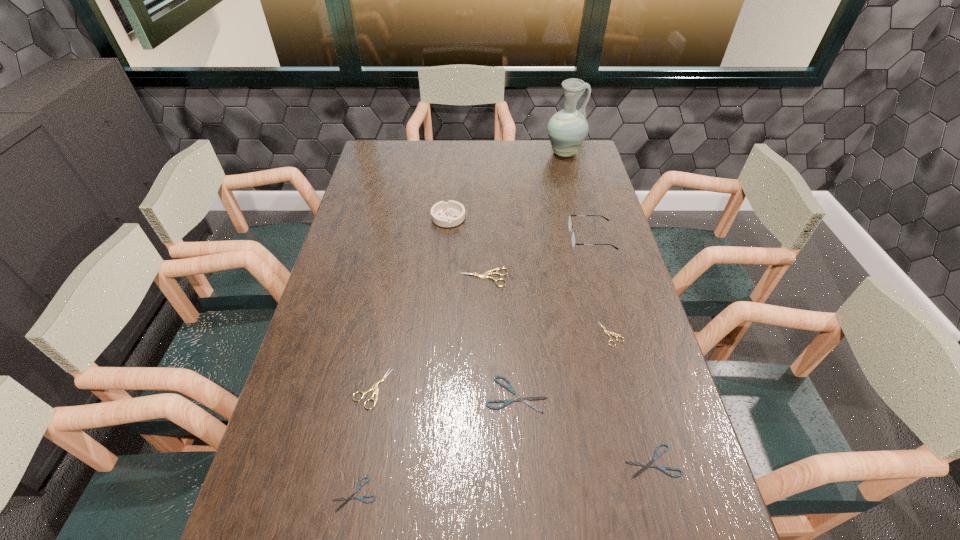
Image resolution: width=960 pixels, height=540 pixels. Identify the location of free space located 0.210m on the front of the second beige shears from left to right. (484, 345).

This screenshot has height=540, width=960. Identify the location of vacant space situated on the front of the fifth shortest shears. (362, 443).

Locate an element on the screen. free space located 0.130m on the back of the second black shears from right to left is located at coordinates (513, 334).

The width and height of the screenshot is (960, 540). Find the location of `free space located 0.100m on the back of the rightmost beige shears`. free space located 0.100m on the back of the rightmost beige shears is located at coordinates (601, 294).

This screenshot has width=960, height=540. I want to click on vacant space located 0.060m on the left of the rightmost black shears, so click(x=597, y=461).

Where is `free location located on the back of the shortest shears`? The width and height of the screenshot is (960, 540). free location located on the back of the shortest shears is located at coordinates 381,354.

Where is `object present at the far edge`? This screenshot has height=540, width=960. object present at the far edge is located at coordinates (567, 129).

The image size is (960, 540). What are the coordinates of `pitcher located at the right edge` in the screenshot? It's located at (567, 129).

Where is `spectacles present at the right edge`? Image resolution: width=960 pixels, height=540 pixels. spectacles present at the right edge is located at coordinates (570, 227).

I want to click on object present at the far right corner, so click(x=567, y=129).